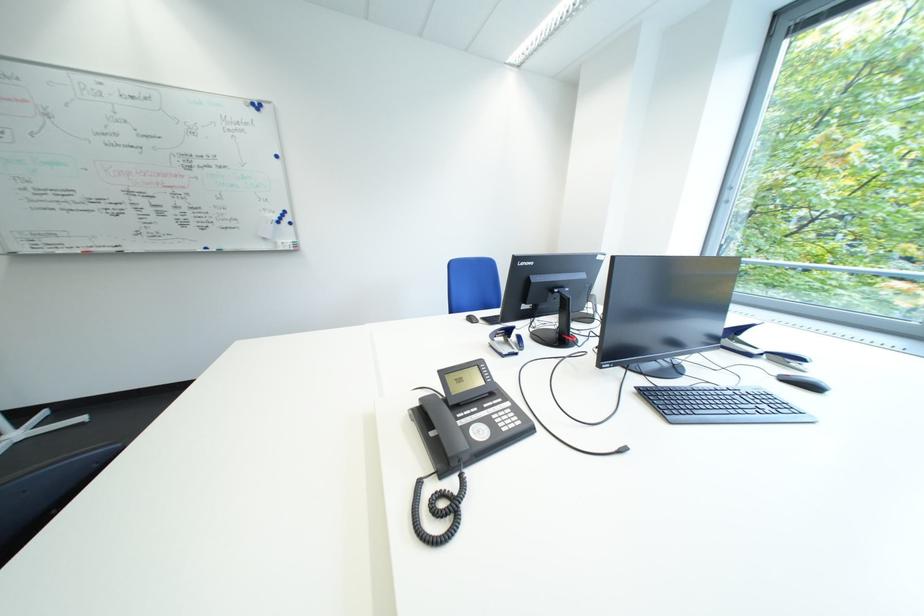
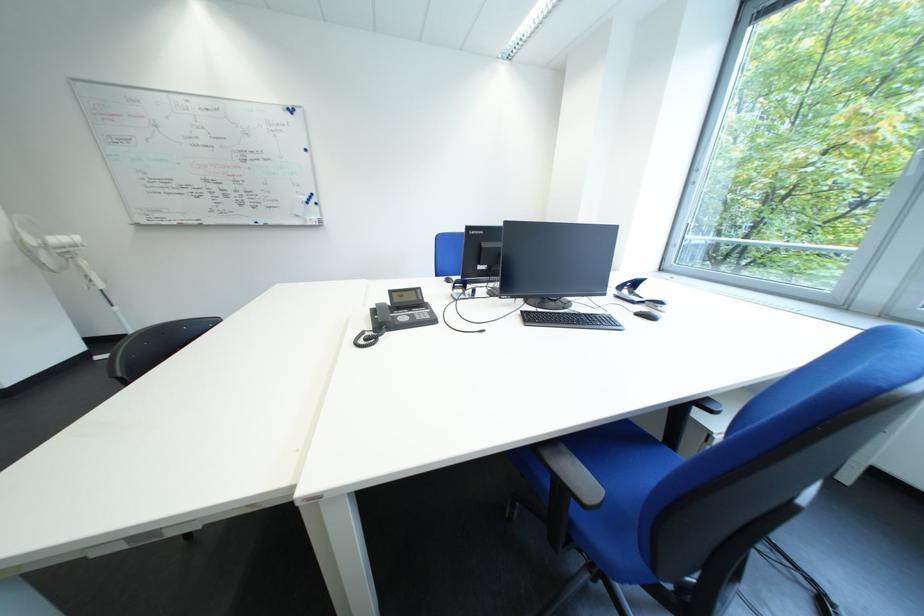
In the second image, find the point that corresponds to pixel 760 358 in the first image.

(645, 305)